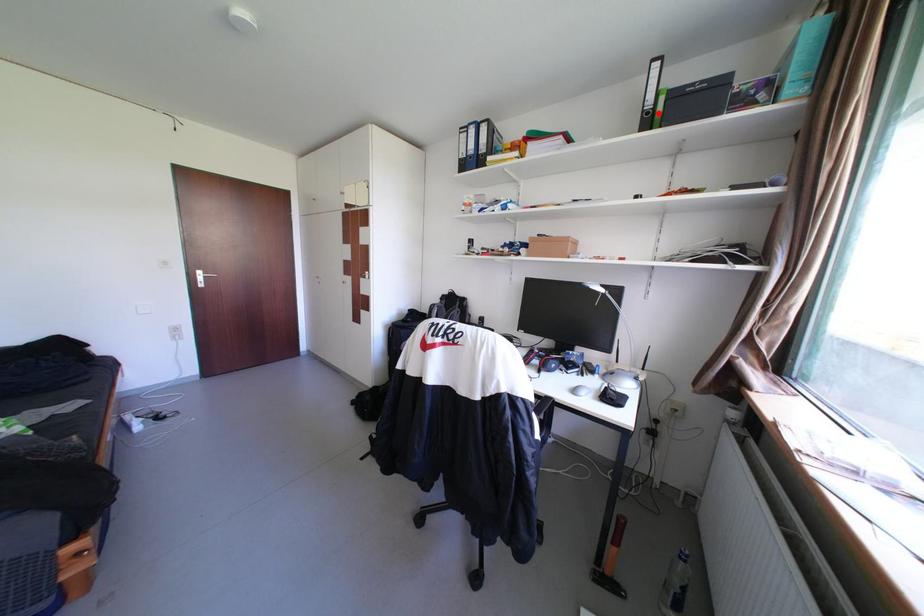
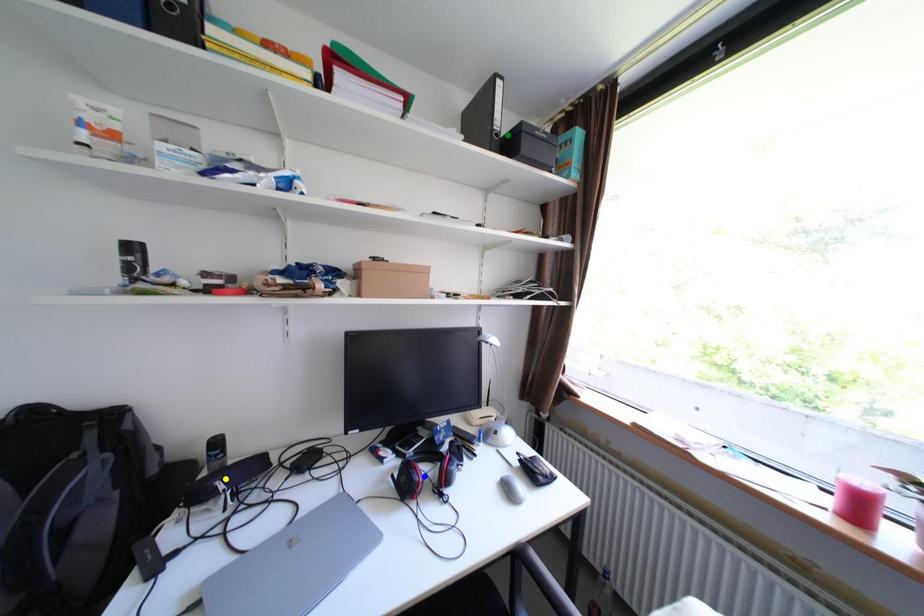
Question: I am providing you with two images of the same scene from different viewpoints. A red point is marked on the first image. You are given multiple points on the second image. Which spot in image 2 lines up with the point in image 1?

Choices:
 (A) yellow point
 (B) green point
 (C) blue point

Answer: (B)